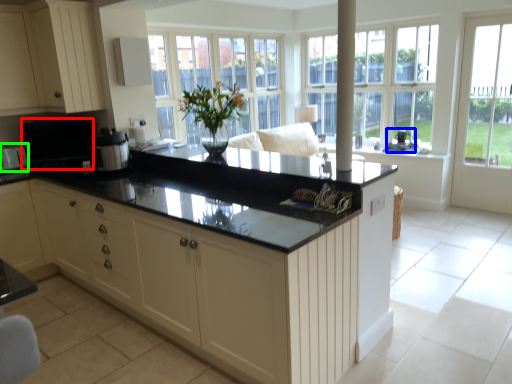
Question: Based on their relative distances, which object is nearer to appliance (highlighted by a red box)? Choose from appliance (highlighted by a blue box) and appliance (highlighted by a green box).

Choices:
 (A) appliance
 (B) appliance

Answer: (B)